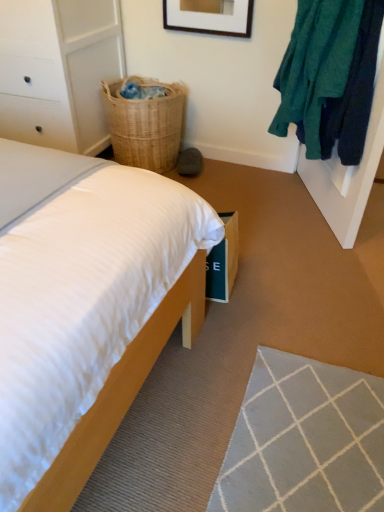
Question: In the image, is white painted wood dresser at left on the left side or the right side of wooden bed at lower left?

Choices:
 (A) right
 (B) left

Answer: (B)

Question: In terms of width, does white painted wood dresser at left look wider or thinner when compared to wooden bed at lower left?

Choices:
 (A) thin
 (B) wide

Answer: (A)

Question: Estimate the real-world distances between objects in this image. Which object is closer to the woven natural basket at upper right?

Choices:
 (A) teal fuzzy sweater at upper right
 (B) wooden bed at lower left
 (C) white painted wood dresser at left

Answer: (C)

Question: Which object is positioned farthest from the wooden bed at lower left?

Choices:
 (A) white painted wood dresser at left
 (B) woven natural basket at upper right
 (C) teal fuzzy sweater at upper right

Answer: (B)